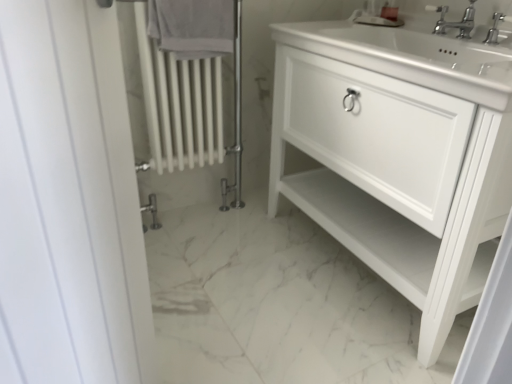
Question: From a real-world perspective, is white matte cabinet at center beneath polished chrome faucet at upper right, positioned as the second tap in left-to-right order?

Choices:
 (A) no
 (B) yes

Answer: (B)

Question: Are white matte cabinet at center and polished chrome faucet at upper right, positioned as the second tap in left-to-right order, beside each other?

Choices:
 (A) no
 (B) yes

Answer: (A)

Question: From the image's perspective, is white matte cabinet at center beneath polished chrome faucet at upper right, the first tap viewed from the right?

Choices:
 (A) no
 (B) yes

Answer: (B)

Question: Is white matte cabinet at center wider than polished chrome faucet at upper right, the first tap viewed from the right?

Choices:
 (A) yes
 (B) no

Answer: (A)

Question: Is white matte cabinet at center further to camera compared to polished chrome faucet at upper right, the first tap viewed from the right?

Choices:
 (A) yes
 (B) no

Answer: (B)

Question: Could polished chrome faucet at upper right, positioned as the second tap in left-to-right order, be considered to be inside white matte cabinet at center?

Choices:
 (A) no
 (B) yes

Answer: (B)

Question: From the image's perspective, is white cotton towel at upper center located above white matte cabinet at center?

Choices:
 (A) no
 (B) yes

Answer: (B)

Question: Can you confirm if white cotton towel at upper center is wider than white matte cabinet at center?

Choices:
 (A) yes
 (B) no

Answer: (B)

Question: Is white cotton towel at upper center not close to white matte cabinet at center?

Choices:
 (A) no
 (B) yes

Answer: (A)

Question: Is white cotton towel at upper center bigger than white matte cabinet at center?

Choices:
 (A) no
 (B) yes

Answer: (A)

Question: Is white cotton towel at upper center with white matte cabinet at center?

Choices:
 (A) yes
 (B) no

Answer: (B)

Question: Is white cotton towel at upper center to the right of white matte cabinet at center from the viewer's perspective?

Choices:
 (A) yes
 (B) no

Answer: (B)

Question: Is white cotton towel at upper center outside polished chrome faucet at upper right, positioned as the second tap in left-to-right order?

Choices:
 (A) yes
 (B) no

Answer: (A)